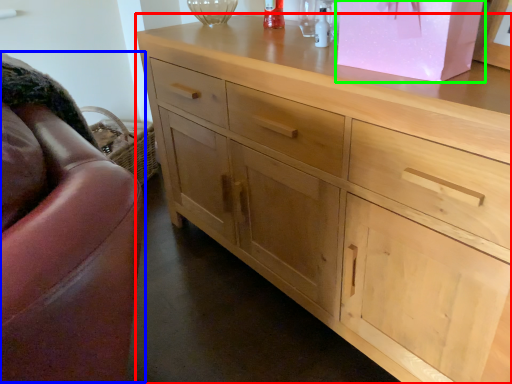
Question: Considering the real-world distances, which object is farthest from chest of drawers (highlighted by a red box)? swivel chair (highlighted by a blue box) or cabinetry (highlighted by a green box)?

Choices:
 (A) swivel chair
 (B) cabinetry

Answer: (A)